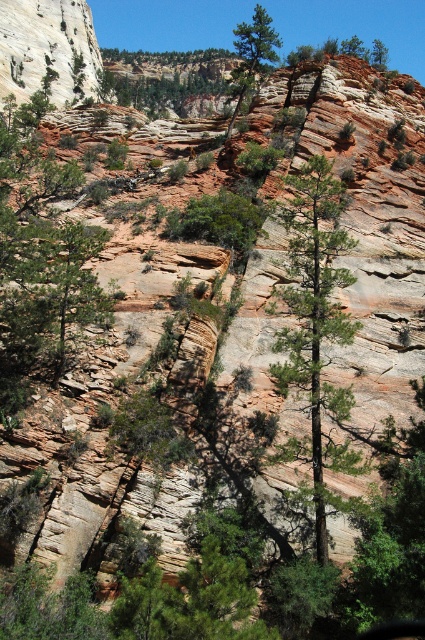
Question: Which of the following is the closest to the observer?

Choices:
 (A) click(x=209, y=49)
 (B) click(x=240, y=80)
 (C) click(x=37, y=164)
 (D) click(x=300, y=336)

Answer: (D)

Question: Which point is farther to the camera?

Choices:
 (A) (x=53, y=298)
 (B) (x=146, y=61)

Answer: (B)

Question: Does green matte tree at left have a lesser width compared to green leafy tree at upper center?

Choices:
 (A) yes
 (B) no

Answer: (A)

Question: Considering the real-world distances, which object is closest to the green textured tree at center?

Choices:
 (A) green matte tree at center
 (B) green leafy tree at upper center
 (C) green matte tree at left

Answer: (A)

Question: From the image, what is the correct spatial relationship of green matte tree at left in relation to green textured tree at center?

Choices:
 (A) left
 (B) right

Answer: (A)

Question: Does green matte tree at center appear on the right side of green leafy tree at upper center?

Choices:
 (A) yes
 (B) no

Answer: (A)